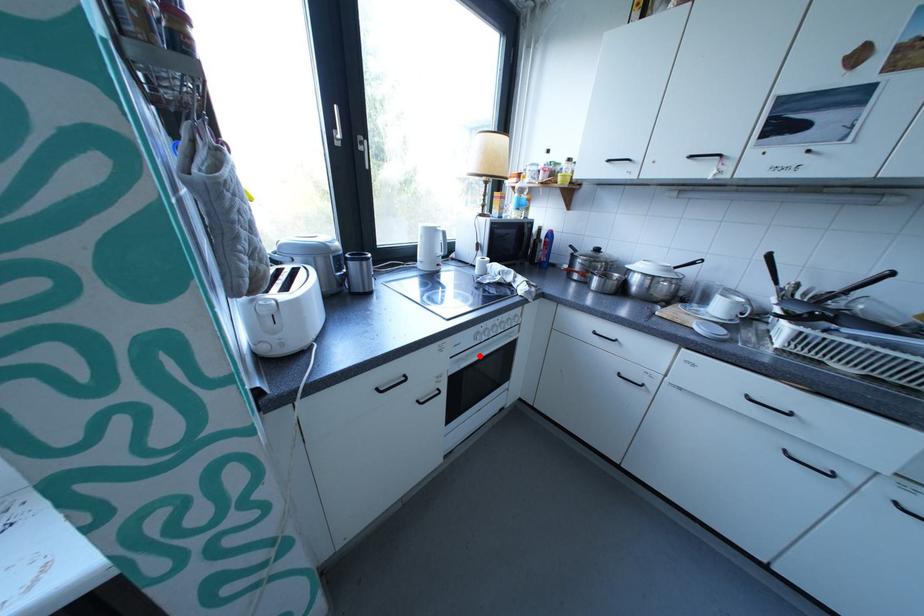
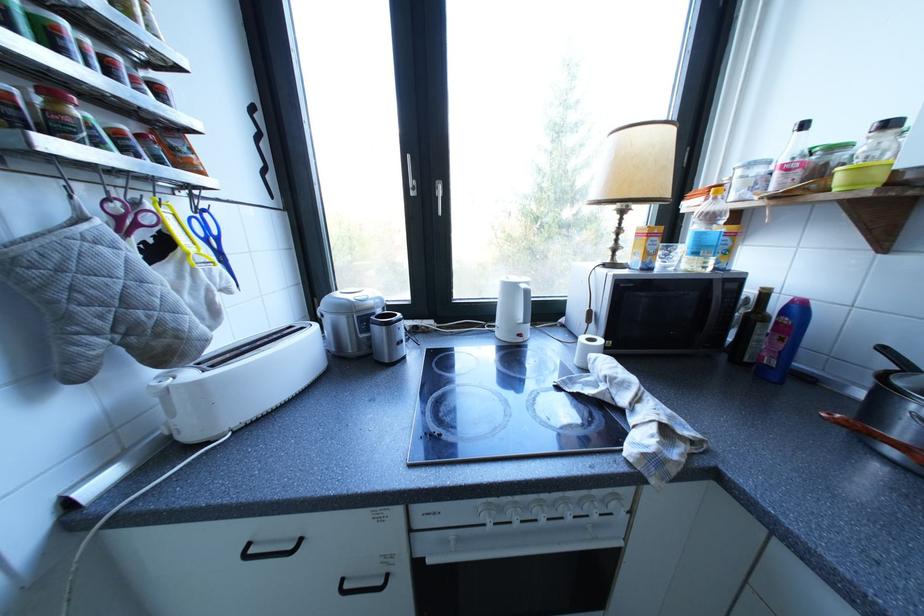
In the second image, find the point that corresponds to the highlighted location in the first image.

(470, 540)